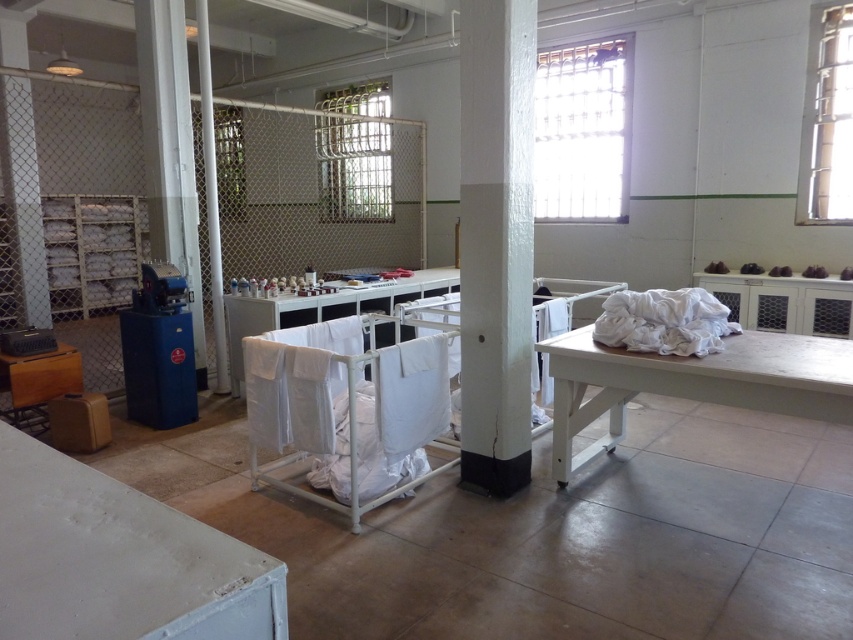
Question: Which point is farther to the camera?

Choices:
 (A) (508, 422)
 (B) (552, 404)
 (C) (158, 225)
 (D) (48, 362)

Answer: (C)

Question: Which object is positioned closest to the white matte table at right?

Choices:
 (A) wooden table at left
 (B) white painted concrete pillar at center
 (C) white glossy pillar at left

Answer: (B)

Question: Is white painted concrete pillar at center smaller than wooden table at left?

Choices:
 (A) no
 (B) yes

Answer: (A)

Question: Observing the image, what is the correct spatial positioning of white matte table at right in reference to wooden table at left?

Choices:
 (A) above
 (B) below

Answer: (A)

Question: Which of these objects is positioned closest to the white matte table at right?

Choices:
 (A) white fabric at center
 (B) white painted concrete pillar at center
 (C) white glossy pillar at left
 (D) wooden table at left

Answer: (A)

Question: Is the position of white matte table at right less distant than that of white glossy pillar at left?

Choices:
 (A) no
 (B) yes

Answer: (B)